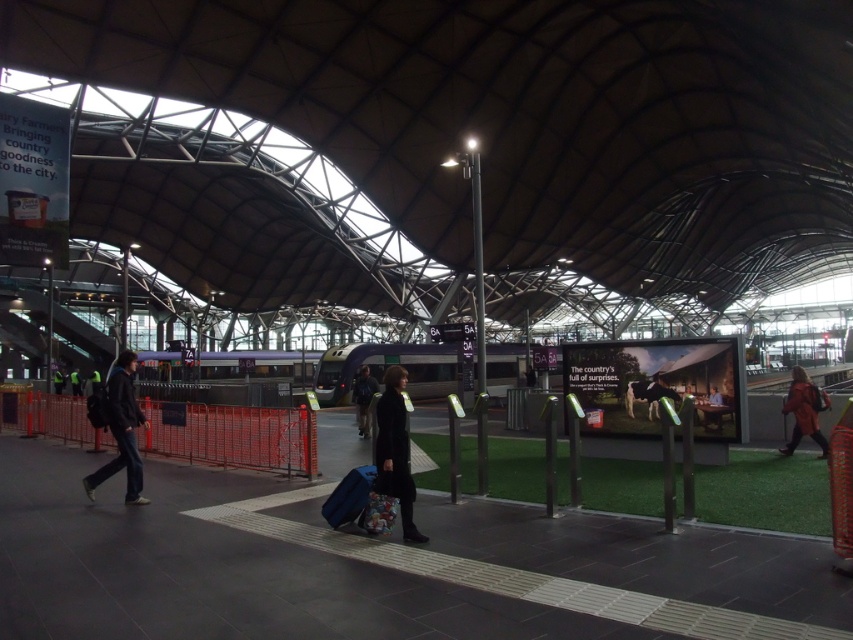
Which is more to the left, dark matte coat at center or dark blue jacket at center?

Positioned to the left is dark blue jacket at center.

Between point (384, 428) and point (376, 392), which one is positioned in front?

Point (384, 428) is more forward.

Which is behind, point (410, 497) or point (366, 394)?

The point (366, 394) is behind.

The width and height of the screenshot is (853, 640). Find the location of `dark matte coat at center`. dark matte coat at center is located at coordinates (395, 451).

Can you confirm if dark matte coat at center is taller than orange leather jacket at right?

Indeed, dark matte coat at center has a greater height compared to orange leather jacket at right.

In the scene shown: Is dark matte coat at center wider than orange leather jacket at right?

Indeed, dark matte coat at center has a greater width compared to orange leather jacket at right.

Between point (397, 412) and point (788, 445), which one is positioned in front?

Positioned in front is point (397, 412).

Identify the location of dark matte coat at center. The height and width of the screenshot is (640, 853). (395, 451).

Is dark blue jacket at center to the left of reflective silver helmet at center from the viewer's perspective?

In fact, dark blue jacket at center is to the right of reflective silver helmet at center.

Which is in front, point (361, 380) or point (57, 365)?

Point (361, 380) is in front.

This screenshot has height=640, width=853. Find the location of `dark blue jacket at center`. dark blue jacket at center is located at coordinates (363, 397).